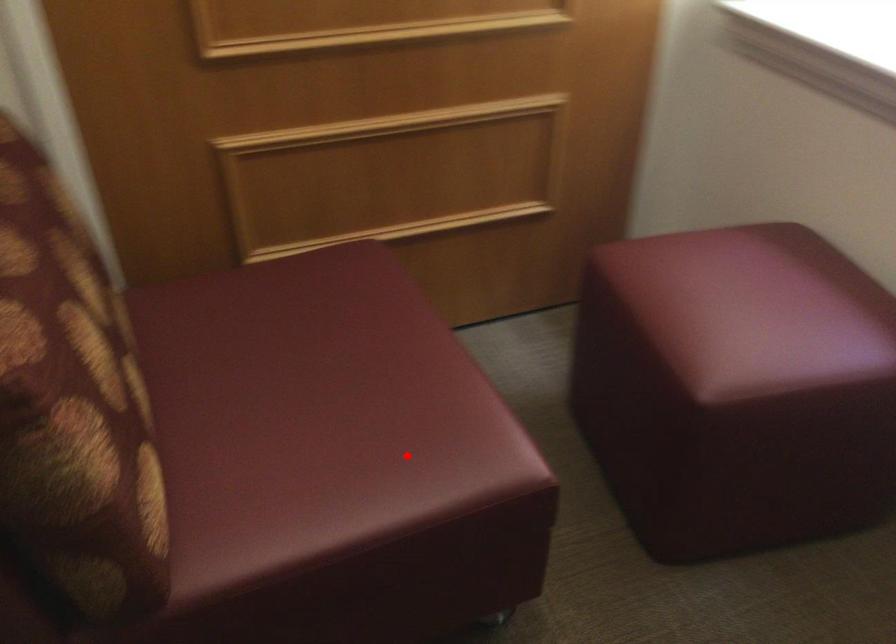
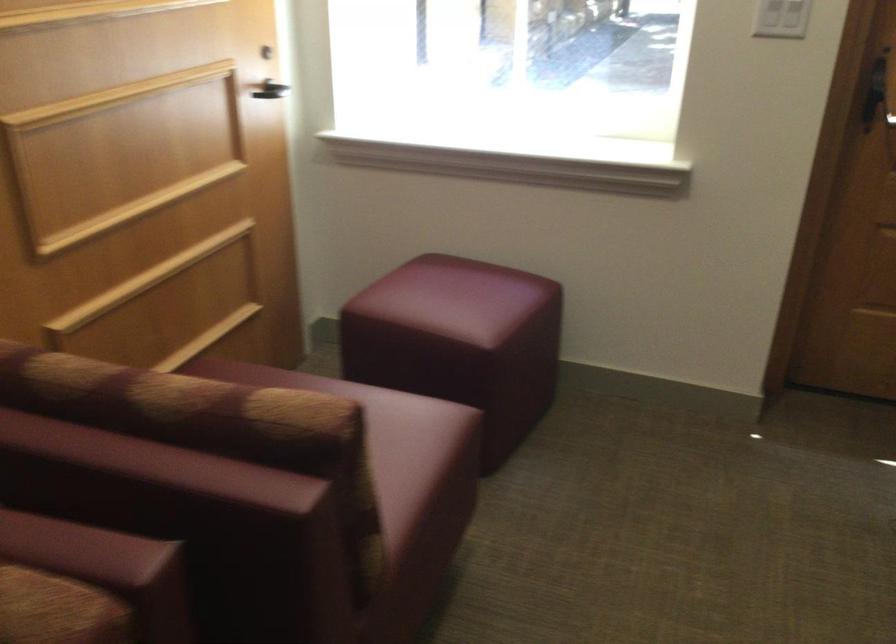
Where in the second image is the point corresponding to the highlighted location from the first image?

(392, 444)